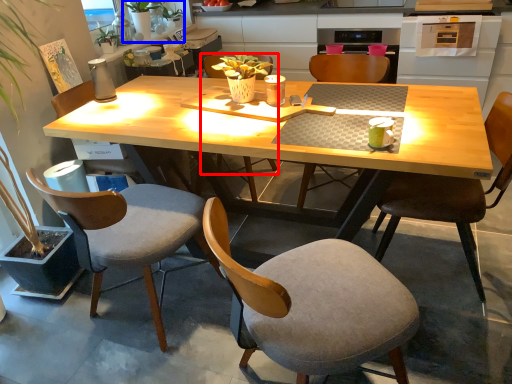
Question: Which object is closer to the camera taking this photo, chair (highlighted by a red box) or houseplant (highlighted by a blue box)?

Choices:
 (A) chair
 (B) houseplant

Answer: (A)